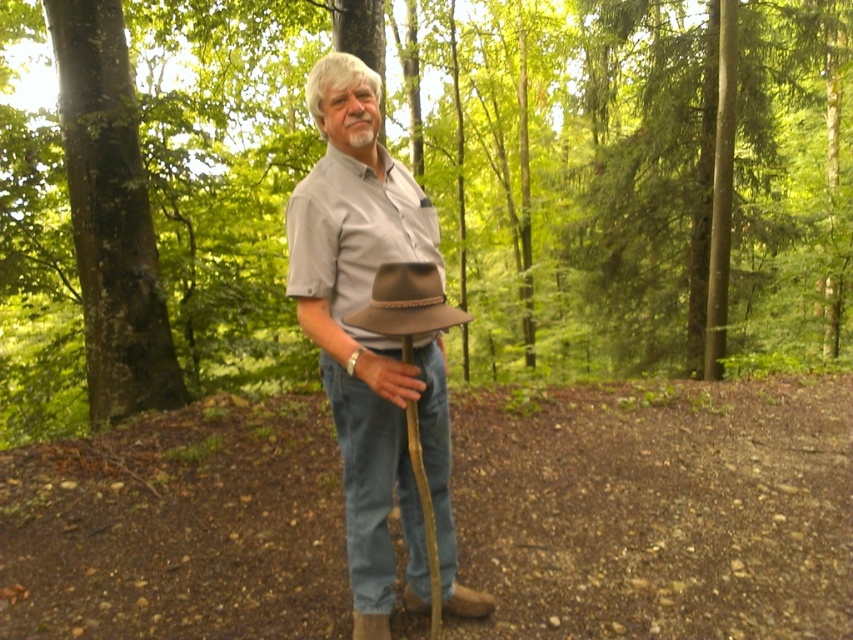
You are a hiker who just arrived at this forest area. You see the brown textured hat at center and the green rough bark tree at left. Which object is positioned higher in the scene?

The brown textured hat at center is located above the green rough bark tree at left, so it is positioned higher in the scene.

You are a hiker who wants to choose a hat that fits better under your backpack. The brown textured hat at center and the brown felt hat at center are both in front of you. Which hat has a smaller width and would be easier to carry?

The brown felt hat at center has a smaller width than the brown textured hat at center, so it would be easier to carry.

You are a hiker who just arrived at the forest area. You see the brown felt hat at center and the green rough bark tree at left. Which object is closer to the ground?

The brown felt hat at center is below green rough bark tree at left, so the brown felt hat at center is closer to the ground.